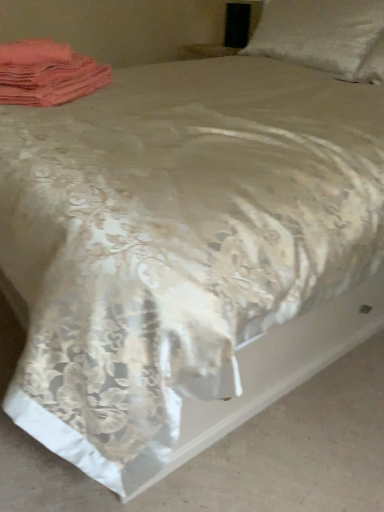
In order to face satin white pillow at upper right, should I rotate leftwards or rightwards?

It's best to rotate right around 16.035 degrees.

Where is `pink fabric at upper left`? This screenshot has height=512, width=384. pink fabric at upper left is located at coordinates (47, 74).

At what (x,y) coordinates should I click in order to perform the action: click on silky beige bedspread at center. Please return your answer as a coordinate pair (x, y). Image resolution: width=384 pixels, height=512 pixels. Looking at the image, I should click on (242, 455).

Describe the element at coordinates (242, 455) in the screenshot. This screenshot has height=512, width=384. I see `silky beige bedspread at center` at that location.

The width and height of the screenshot is (384, 512). I want to click on satin white pillow at upper right, so click(324, 36).

Does pink fabric at upper left appear on the left side of silky beige bedspread at center?

Yes, pink fabric at upper left is to the left of silky beige bedspread at center.

From the image's perspective, between pink fabric at upper left and silky beige bedspread at center, who is located below?

silky beige bedspread at center appears lower in the image.

Based on the photo, considering the sizes of objects pink fabric at upper left and silky beige bedspread at center in the image provided, who is thinner, pink fabric at upper left or silky beige bedspread at center?

With smaller width is pink fabric at upper left.

From a real-world perspective, is pink fabric at upper left positioned under silky beige bedspread at center based on gravity?

No.

Could you tell me if satin white pillow at upper right is facing pink fabric at upper left?

Yes, satin white pillow at upper right is turned towards pink fabric at upper left.

Looking at this image, would you say pink fabric at upper left is part of satin white pillow at upper right's contents?

No.

Is satin white pillow at upper right further to the viewer compared to pink fabric at upper left?

Yes, it is behind pink fabric at upper left.

Which object is wider, satin white pillow at upper right or pink fabric at upper left?

satin white pillow at upper right.

Would you say satin white pillow at upper right is outside silky beige bedspread at center?

Yes, satin white pillow at upper right is outside of silky beige bedspread at center.

This screenshot has height=512, width=384. Find the location of `pillow on the right of silky beige bedspread at center`. pillow on the right of silky beige bedspread at center is located at coordinates (324, 36).

In terms of width, does satin white pillow at upper right look wider or thinner when compared to silky beige bedspread at center?

In the image, satin white pillow at upper right appears to be more narrow than silky beige bedspread at center.

Is pink fabric at upper left turned away from satin white pillow at upper right?

That's not correct — pink fabric at upper left is not looking away from satin white pillow at upper right.

You are a GUI agent. You are given a task and a screenshot of the screen. Output one action in this format:
    pyautogui.click(x=<x>, y=<y>)
    Task: Click on the material on the left of satin white pillow at upper right
    This screenshot has height=512, width=384.
    Given the screenshot: What is the action you would take?
    47,74

Which object is more forward, pink fabric at upper left or satin white pillow at upper right?

Positioned in front is pink fabric at upper left.

Considering the sizes of objects pink fabric at upper left and satin white pillow at upper right in the image provided, who is smaller, pink fabric at upper left or satin white pillow at upper right?

pink fabric at upper left.

Is silky beige bedspread at center positioned in front of satin white pillow at upper right?

Yes.

Does point (363, 479) appear closer or farther from the camera than point (285, 2)?

Point (363, 479) is closer to the camera than point (285, 2).

Considering the sizes of objects silky beige bedspread at center and satin white pillow at upper right in the image provided, who is wider, silky beige bedspread at center or satin white pillow at upper right?

silky beige bedspread at center is wider.

Are silky beige bedspread at center and satin white pillow at upper right beside each other?

No, silky beige bedspread at center is not in contact with satin white pillow at upper right.

How many degrees apart are the facing directions of silky beige bedspread at center and pink fabric at upper left?

The angular difference between silky beige bedspread at center and pink fabric at upper left is 38 degrees.

Between silky beige bedspread at center and pink fabric at upper left, which one has smaller width?

pink fabric at upper left is thinner.

From a real-world perspective, is silky beige bedspread at center positioned over pink fabric at upper left based on gravity?

No, from a real-world perspective, silky beige bedspread at center is not over pink fabric at upper left

Is pink fabric at upper left completely or partially inside silky beige bedspread at center?

That's incorrect, pink fabric at upper left is not inside silky beige bedspread at center.

Locate an element on the screen. concrete below the pink fabric at upper left (from the image's perspective) is located at coordinates (242, 455).

In order to click on pillow on the right of pink fabric at upper left in this screenshot , I will do `click(324, 36)`.

Estimate the real-world distances between objects in this image. Which object is further from pink fabric at upper left, satin white pillow at upper right or silky beige bedspread at center?

satin white pillow at upper right lies further to pink fabric at upper left than the other object.

Looking at the image, which one is located closer to satin white pillow at upper right, silky beige bedspread at center or pink fabric at upper left?

Based on the image, pink fabric at upper left appears to be nearer to satin white pillow at upper right.

Which object lies further to the anchor point satin white pillow at upper right, pink fabric at upper left or silky beige bedspread at center?

silky beige bedspread at center.

From the picture: From the image, which object appears to be farther from silky beige bedspread at center, pink fabric at upper left or satin white pillow at upper right?

satin white pillow at upper right is positioned further to the anchor silky beige bedspread at center.

When comparing their distances from pink fabric at upper left, does silky beige bedspread at center or satin white pillow at upper right seem closer?

Based on the image, silky beige bedspread at center appears to be nearer to pink fabric at upper left.

Estimate the real-world distances between objects in this image. Which object is further from silky beige bedspread at center, satin white pillow at upper right or pink fabric at upper left?

The object further to silky beige bedspread at center is satin white pillow at upper right.

The height and width of the screenshot is (512, 384). I want to click on material between satin white pillow at upper right and silky beige bedspread at center in the vertical direction, so click(47, 74).